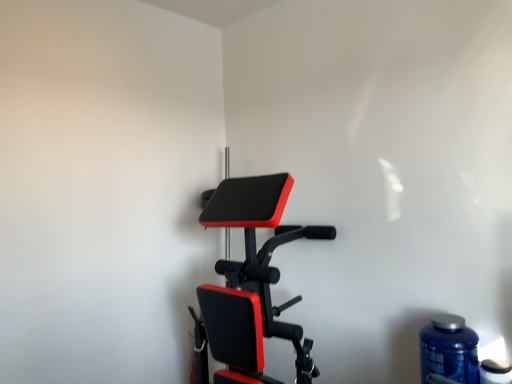
Question: Does matte black stationary bicycle at center have a greater height compared to blue plastic bottle at lower right, which is counted as the 2th bottle, starting from the right?

Choices:
 (A) no
 (B) yes

Answer: (B)

Question: Is matte black stationary bicycle at center outside blue plastic bottle at lower right, which is counted as the 2th bottle, starting from the right?

Choices:
 (A) no
 (B) yes

Answer: (B)

Question: Considering the relative positions of matte black stationary bicycle at center and blue plastic bottle at lower right, which is counted as the 2th bottle, starting from the right, in the image provided, is matte black stationary bicycle at center to the left of blue plastic bottle at lower right, which is counted as the 2th bottle, starting from the right, from the viewer's perspective?

Choices:
 (A) yes
 (B) no

Answer: (A)

Question: Could you tell me if matte black stationary bicycle at center is turned towards blue plastic bottle at lower right, which is counted as the 2th bottle, starting from the right?

Choices:
 (A) yes
 (B) no

Answer: (B)

Question: Is matte black stationary bicycle at center to the right of blue plastic bottle at lower right, which is counted as the 2th bottle, starting from the right, from the viewer's perspective?

Choices:
 (A) yes
 (B) no

Answer: (B)

Question: Is matte black stationary bicycle at center bigger than blue plastic bottle at lower right, the first bottle from the left?

Choices:
 (A) yes
 (B) no

Answer: (A)

Question: Is blue plastic bottle at lower right, positioned as the 1th bottle in right-to-left order, thinner than blue plastic bottle at lower right, the first bottle from the left?

Choices:
 (A) yes
 (B) no

Answer: (A)

Question: Does blue plastic bottle at lower right, which is the 2th bottle from left to right, turn towards blue plastic bottle at lower right, which is counted as the 2th bottle, starting from the right?

Choices:
 (A) no
 (B) yes

Answer: (A)

Question: Is blue plastic bottle at lower right, the first bottle from the left, at the back of blue plastic bottle at lower right, which is the 2th bottle from left to right?

Choices:
 (A) yes
 (B) no

Answer: (B)

Question: Considering the relative sizes of blue plastic bottle at lower right, positioned as the 1th bottle in right-to-left order, and blue plastic bottle at lower right, which is counted as the 2th bottle, starting from the right, in the image provided, is blue plastic bottle at lower right, positioned as the 1th bottle in right-to-left order, wider than blue plastic bottle at lower right, which is counted as the 2th bottle, starting from the right,?

Choices:
 (A) yes
 (B) no

Answer: (B)

Question: From the image's perspective, would you say blue plastic bottle at lower right, positioned as the 1th bottle in right-to-left order, is shown under blue plastic bottle at lower right, which is counted as the 2th bottle, starting from the right?

Choices:
 (A) no
 (B) yes

Answer: (B)

Question: Does blue plastic bottle at lower right, which is the 2th bottle from left to right, appear on the right side of blue plastic bottle at lower right, which is counted as the 2th bottle, starting from the right?

Choices:
 (A) yes
 (B) no

Answer: (A)

Question: Is blue plastic bottle at lower right, the first bottle from the left, smaller than blue plastic bottle at lower right, which is the 2th bottle from left to right?

Choices:
 (A) yes
 (B) no

Answer: (B)